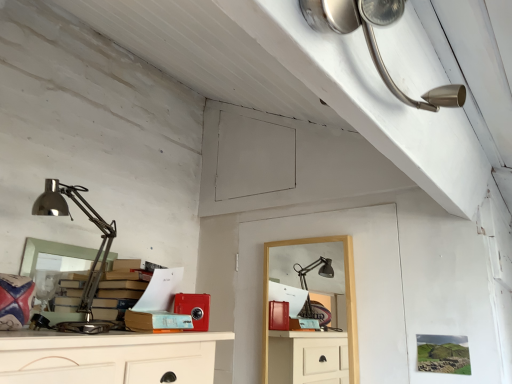
Question: Which is correct: polished metal desk lamp at left, which is the 2th lamp from top to bottom, is inside satin nickel lamp at upper right, the second lamp from the bottom, or outside of it?

Choices:
 (A) inside
 (B) outside

Answer: (B)

Question: Is point [91, 317] closer or farther from the camera than point [311, 23]?

Choices:
 (A) farther
 (B) closer

Answer: (A)

Question: Considering the real-world distances, which object is closest to the polished metal desk lamp at left, marked as the second lamp in a right-to-left arrangement?

Choices:
 (A) wooden desk at center
 (B) satin nickel lamp at upper right, the second lamp from the bottom

Answer: (A)

Question: Based on their relative distances, which object is nearer to the satin nickel lamp at upper right, arranged as the 1th lamp when viewed from the front?

Choices:
 (A) wooden desk at center
 (B) polished metal desk lamp at left, which ranks as the 1th lamp in left-to-right order

Answer: (A)